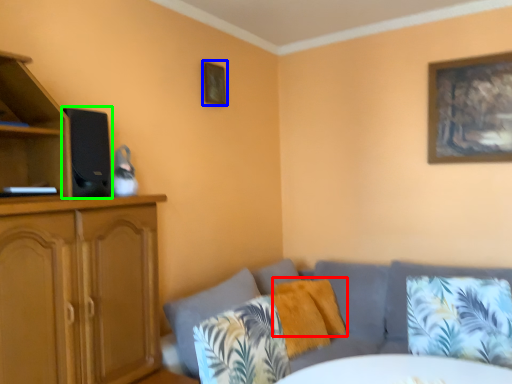
Question: Which is farther away from pillow (highlighted by a red box)? picture frame (highlighted by a blue box) or speaker (highlighted by a green box)?

Choices:
 (A) picture frame
 (B) speaker

Answer: (B)